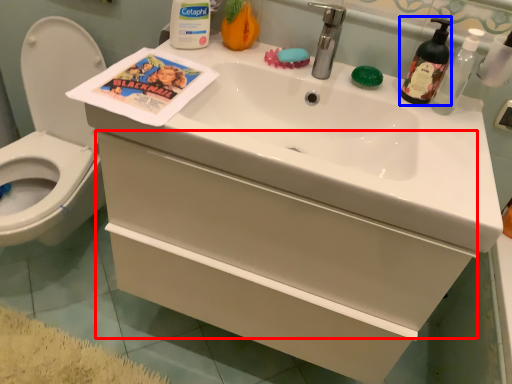
Question: Which object is further to the camera taking this photo, drawer (highlighted by a red box) or soap dispenser (highlighted by a blue box)?

Choices:
 (A) drawer
 (B) soap dispenser

Answer: (B)